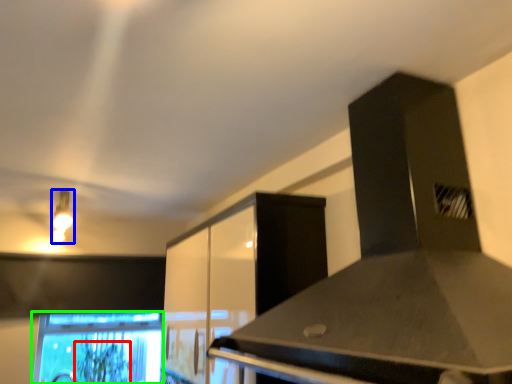
Question: Estimate the real-world distances between objects in this image. Which object is closer to plant (highlighted by a red box), light fixture (highlighted by a blue box) or computer monitor (highlighted by a green box)?

Choices:
 (A) light fixture
 (B) computer monitor

Answer: (B)